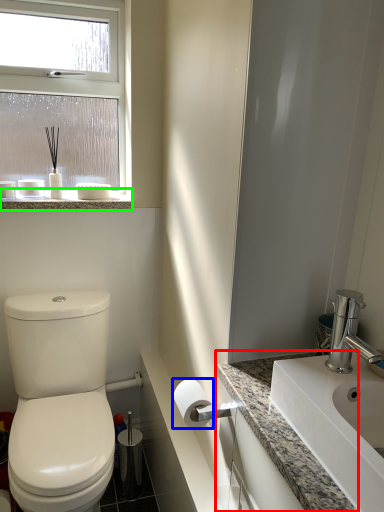
Question: Which is farther away from counter top (highlighted by a red box)? toilet paper (highlighted by a blue box) or window sill (highlighted by a green box)?

Choices:
 (A) toilet paper
 (B) window sill

Answer: (B)